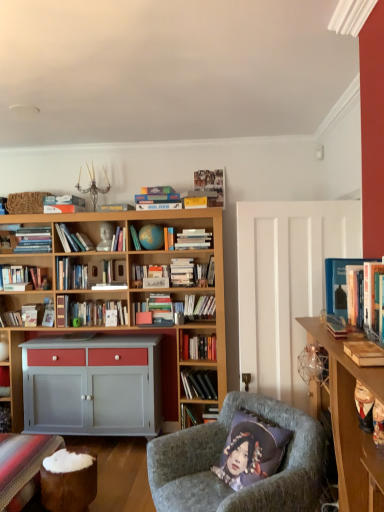
This screenshot has width=384, height=512. I want to click on black matte book at center, the 5th book when ordered from front to back, so click(x=199, y=384).

Describe the element at coordinates (193, 239) in the screenshot. I see `white matte bookshelf at center, the 8th book when ordered from left to right` at that location.

The image size is (384, 512). I want to click on hardcover book at upper center, arranged as the 8th book when viewed from the right, so click(x=158, y=198).

How much space does hardcover books at left, which ranks as the second book in left-to-right order, occupy horizontally?

hardcover books at left, which ranks as the second book in left-to-right order, is 26.37 centimeters in width.

Describe the element at coordinates (151, 237) in the screenshot. This screenshot has height=512, width=384. I see `teal globe at center` at that location.

Identify the location of black matte book at center, the 5th book when ordered from front to back. This screenshot has width=384, height=512. (199, 384).

In the scene shown: From the image's perspective, is hardcover book at center, which appears as the fourth book when viewed from the left, beneath wooden carved figurine at right, acting as the second toy starting from the front?

Actually, hardcover book at center, which appears as the fourth book when viewed from the left, appears above wooden carved figurine at right, acting as the second toy starting from the front, in the image.

In terms of size, does hardcover book at center, which ranks as the 7th book in front-to-back order, appear bigger or smaller than wooden carved figurine at right, acting as the second toy starting from the front?

hardcover book at center, which ranks as the 7th book in front-to-back order, is bigger than wooden carved figurine at right, acting as the second toy starting from the front.

Which object is positioned more to the left, hardcover book at center, which appears as the fourth book when viewed from the left, or wooden carved figurine at right, acting as the first toy starting from the back?

From the viewer's perspective, hardcover book at center, which appears as the fourth book when viewed from the left, appears more on the left side.

Is wooden carved figurine at right, acting as the second toy starting from the front, located within hardcover book at center, which appears as the fourth book when viewed from the left?

No, wooden carved figurine at right, acting as the second toy starting from the front, is not surrounded by hardcover book at center, which appears as the fourth book when viewed from the left.

Consider the image. Is hardcover book at center-left, the 2th book from the back, inside the boundaries of blue hardcover book at right, positioned as the first book in right-to-left order, or outside?

hardcover book at center-left, the 2th book from the back, is spatially situated outside blue hardcover book at right, positioned as the first book in right-to-left order.

Consider the image. Can you see hardcover book at center-left, the eleventh book viewed from the front, touching blue hardcover book at right, which is the eleventh book in back-to-front order?

No, hardcover book at center-left, the eleventh book viewed from the front, is not in contact with blue hardcover book at right, which is the eleventh book in back-to-front order.

Consider the image. Does hardcover book at center-left, which ranks as the 10th book in right-to-left order, have a lesser height compared to blue hardcover book at right, the 12th book viewed from the left?

No, hardcover book at center-left, which ranks as the 10th book in right-to-left order, is not shorter than blue hardcover book at right, the 12th book viewed from the left.

Which object is further away from the camera taking this photo, hardcover book at center-left, which ranks as the 10th book in right-to-left order, or blue hardcover book at right, the 12th book viewed from the left?

hardcover book at center-left, which ranks as the 10th book in right-to-left order, is more distant.

Between point (362, 419) and point (189, 249), which one is positioned behind?

The point (189, 249) is behind.

Is wooden carved figurine at right, acting as the first toy starting from the back, facing towards white matte bookshelf at center, arranged as the 10th book when viewed from the back?

No, wooden carved figurine at right, acting as the first toy starting from the back, is not facing towards white matte bookshelf at center, arranged as the 10th book when viewed from the back.

From a real-world perspective, is wooden carved figurine at right, acting as the first toy starting from the back, below white matte bookshelf at center, which appears as the 3th book when viewed from the front?

Correct, in the physical world, wooden carved figurine at right, acting as the first toy starting from the back, is lower than white matte bookshelf at center, which appears as the 3th book when viewed from the front.

Does wooden carved figurine at right, acting as the second toy starting from the front, have a larger size compared to white matte bookshelf at center, the 5th book positioned from the right?

Actually, wooden carved figurine at right, acting as the second toy starting from the front, might be smaller than white matte bookshelf at center, the 5th book positioned from the right.

Considering the sizes of objects white glossy book at center, the 9th book positioned from the front, and velvet grey armchair at center in the image provided, who is shorter, white glossy book at center, the 9th book positioned from the front, or velvet grey armchair at center?

white glossy book at center, the 9th book positioned from the front.

Is white glossy book at center, which ranks as the seventh book in right-to-left order, bigger than velvet grey armchair at center?

No.

Does white glossy book at center, arranged as the sixth book when viewed from the left, have a lesser width compared to velvet grey armchair at center?

Yes.

From a real-world perspective, is white glossy book at center, which ranks as the seventh book in right-to-left order, physically below velvet grey armchair at center?

No.

In the scene shown: Can we say hardcover books at left, which ranks as the second book in left-to-right order, lies outside hardcover book at left, placed as the first book when sorted from left to right?

Absolutely, hardcover books at left, which ranks as the second book in left-to-right order, is external to hardcover book at left, placed as the first book when sorted from left to right.

In the image, is hardcover books at left, arranged as the tenth book when viewed from the front, on the left side or the right side of hardcover book at left, placed as the first book when sorted from left to right?

Based on their positions, hardcover books at left, arranged as the tenth book when viewed from the front, is located to the right of hardcover book at left, placed as the first book when sorted from left to right.

You are a GUI agent. You are given a task and a screenshot of the screen. Output one action in this format:
    pyautogui.click(x=<x>, y=<y>)
    Task: Click on the 6th book located beneath the hardcover books at left, which ranks as the second book in left-to-right order (from a real-world perspective)
    This screenshot has height=512, width=384.
    Given the screenshot: What is the action you would take?
    pyautogui.click(x=26, y=277)

Is the position of hardcover book at center less distant than that of white glossy book at center, which ranks as the seventh book in right-to-left order?

No, it is not.

Which of these two, hardcover book at center or white glossy book at center, arranged as the sixth book when viewed from the left, is bigger?

hardcover book at center is bigger.

In the scene shown: From the image's perspective, which is above, hardcover book at center or white glossy book at center, arranged as the sixth book when viewed from the left?

white glossy book at center, arranged as the sixth book when viewed from the left, is shown above in the image.

Is hardcover books at center, which is the sixth book in front-to-back order, inside the boundaries of hardcover book at center, or outside?

hardcover books at center, which is the sixth book in front-to-back order, exists outside the volume of hardcover book at center.

Can you tell me how much hardcover books at center, which is the sixth book in front-to-back order, and hardcover book at center differ in facing direction?

The angular difference between hardcover books at center, which is the sixth book in front-to-back order, and hardcover book at center is 0.253 degrees.

Between hardcover books at center, placed as the 7th book when sorted from back to front, and hardcover book at center, which one has more height?

hardcover books at center, placed as the 7th book when sorted from back to front, is taller.

Does point (194, 315) come closer to viewer compared to point (166, 273)?

No.

Which book is the 5th one when counting from the back of the wooden carved figurine at right, acting as the second toy starting from the front? Please provide its 2D coordinates.

[(119, 240)]

At what (x,y) coordinates should I click in order to perform the action: click on book that is the 9th object to the right of the hardcover book at center-left, the 2th book from the back, starting at the anchor. Please return your answer as a coordinate pair (x, y). The height and width of the screenshot is (512, 384). Looking at the image, I should click on (346, 289).

Consider the image. Estimate the real-world distances between objects in this image. Which object is closer to hardcover book at center, which appears as the fourth book when viewed from the left, black matte book at center, the 10th book positioned from the left, or white matte bookshelf at center, the 5th book positioned from the right?

white matte bookshelf at center, the 5th book positioned from the right.

Based on their spatial positions, is white matte bookshelf at center, the 5th book positioned from the right, or velvet grey armchair at center closer to velvet purple pillow at lower center?

Among the two, velvet grey armchair at center is located nearer to velvet purple pillow at lower center.

When comparing their distances from hardcover books at center, placed as the 4th book when sorted from right to left, does wooden carved figurine at right, acting as the first toy starting from the back, or white matte bookshelf at center, which appears as the 3th book when viewed from the front, seem closer?

white matte bookshelf at center, which appears as the 3th book when viewed from the front, is positioned closer to the anchor hardcover books at center, placed as the 4th book when sorted from right to left.

Considering their positions, is hardcover book at center, positioned as the ninth book in right-to-left order, positioned further to hardcover books at center, which is the sixth book in front-to-back order, than teal globe at center?

The object further to hardcover books at center, which is the sixth book in front-to-back order, is hardcover book at center, positioned as the ninth book in right-to-left order.

From the image, which object appears to be farther from hardcover book at center, shiny plastic toy at right, placed as the second toy when sorted from back to front, or wooden desk at right?

Among the two, shiny plastic toy at right, placed as the second toy when sorted from back to front, is located further to hardcover book at center.

When comparing their distances from wooden carved figurine at right, acting as the first toy starting from the back, does hardcover books at left, which ranks as the second book in left-to-right order, or velvet grey armchair at center seem closer?

velvet grey armchair at center.

Which object lies further to the anchor point velvet purple pillow at lower center, velvet grey armchair at center or wooden desk at right?

wooden desk at right is further to velvet purple pillow at lower center.

Looking at the image, which one is located closer to wooden carved figurine at right, acting as the first toy starting from the back, hardcover books at left, which ranks as the second book in left-to-right order, or black matte book at center, the 5th book when ordered from front to back?

The object closer to wooden carved figurine at right, acting as the first toy starting from the back, is black matte book at center, the 5th book when ordered from front to back.

Where is `book between hardcover book at center-left, which ranks as the 10th book in right-to-left order, and hardcover book at center, in the horizontal direction`? The height and width of the screenshot is (512, 384). book between hardcover book at center-left, which ranks as the 10th book in right-to-left order, and hardcover book at center, in the horizontal direction is located at coordinates (119, 240).

Locate an element on the screen. The image size is (384, 512). chair positioned between wooden carved figurine at right, acting as the first toy starting from the back, and hardcover books at left, which appears as the eleventh book when viewed from the right, from near to far is located at coordinates (219, 458).

Where is `chair positioned between shiny plastic toy at right, placed as the second toy when sorted from back to front, and hardcover book at upper center, which appears as the fifth book when viewed from the left, from near to far`? chair positioned between shiny plastic toy at right, placed as the second toy when sorted from back to front, and hardcover book at upper center, which appears as the fifth book when viewed from the left, from near to far is located at coordinates (219, 458).

Identify the location of teal between wooden carved figurine at right, acting as the first toy starting from the back, and hardcover book at center-left, which ranks as the 10th book in right-to-left order, in the front-back direction. The image size is (384, 512). (151, 237).